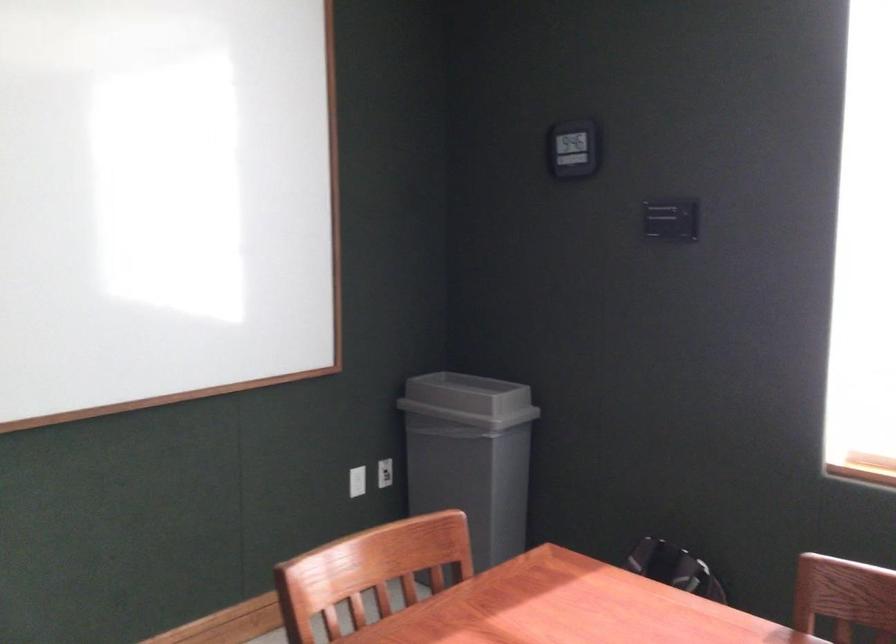
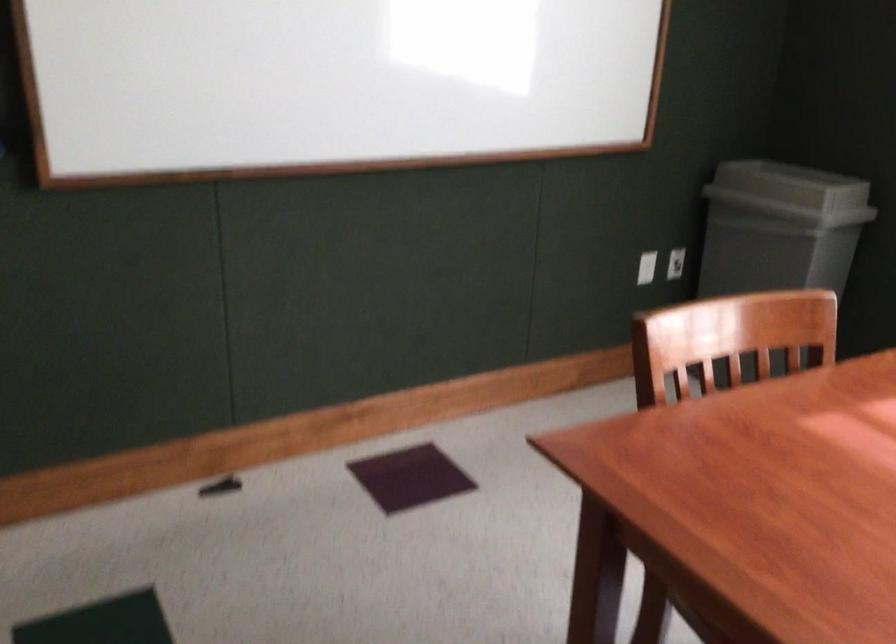
Where in the second image is the point corresponding to point 382,478 from the first image?

(675, 263)